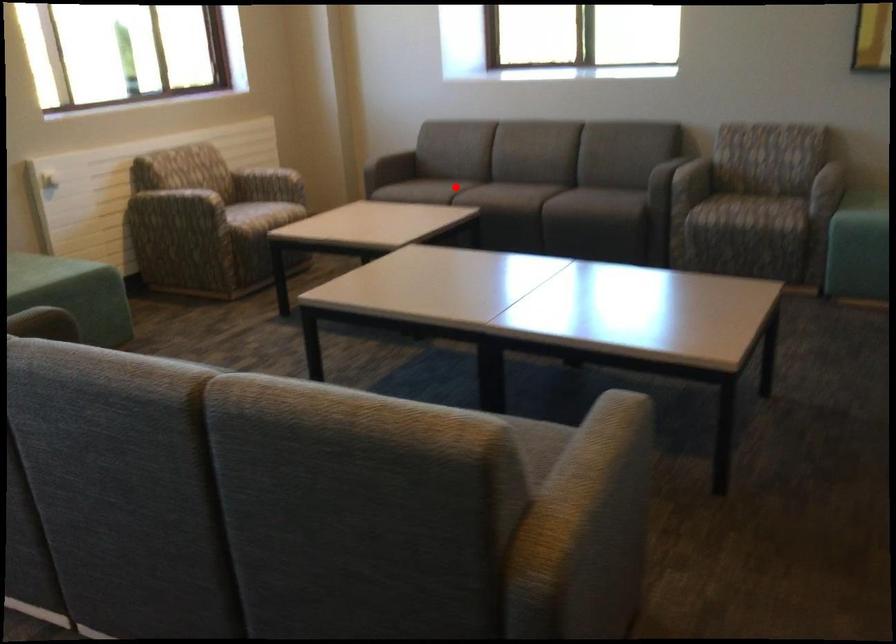
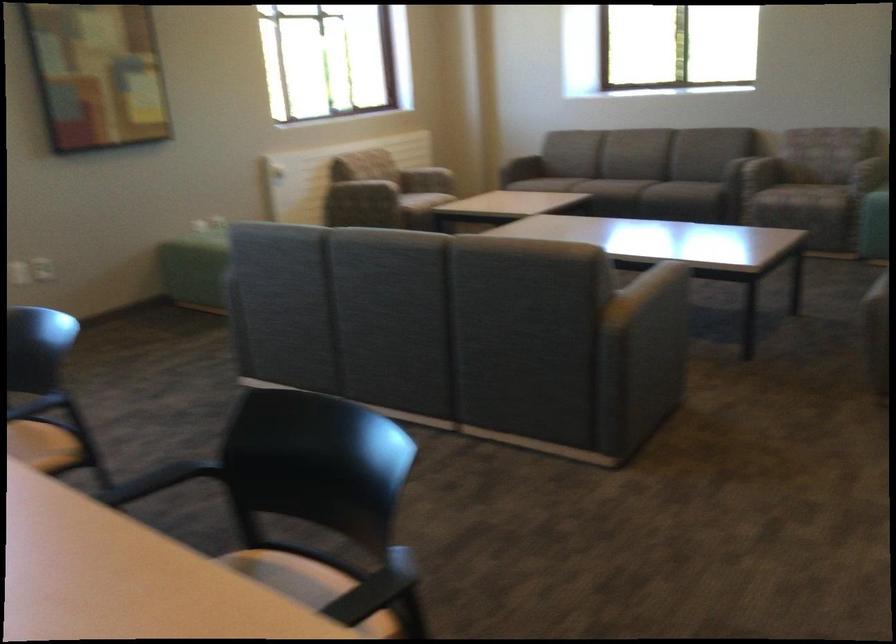
Question: I am providing you with two images of the same scene from different viewpoints. A red point is marked on the first image. Can you still see the location of the red point in image 2?

Choices:
 (A) Yes
 (B) No

Answer: (B)